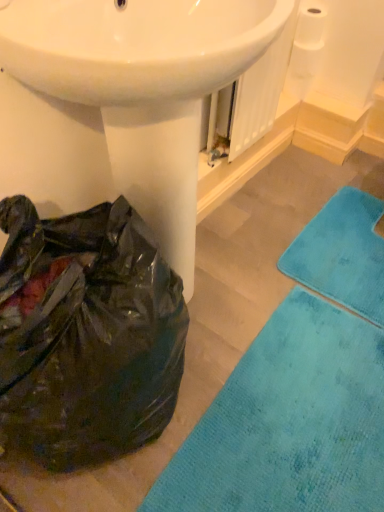
This screenshot has height=512, width=384. What are the coordinates of `vacant space situated above teal soft rug at lower right (from a real-world perspective)` in the screenshot? It's located at (289, 413).